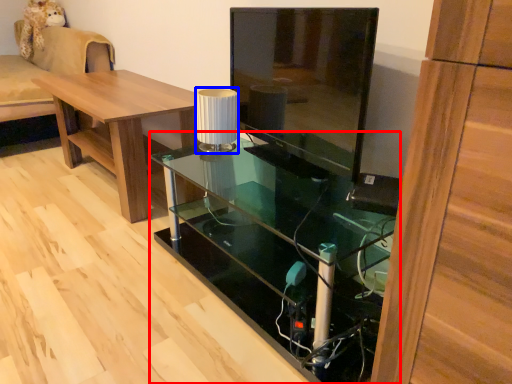
Question: Which object appears closest to the camera in this image, desk (highlighted by a red box) or lamp (highlighted by a blue box)?

Choices:
 (A) desk
 (B) lamp

Answer: (A)